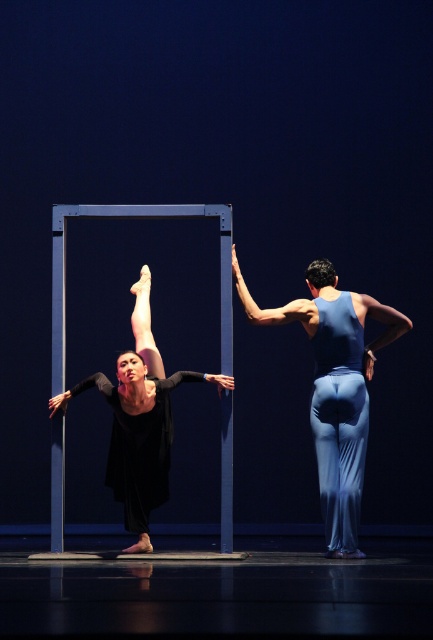
Question: Is blue fabric pants at center bigger than black matte dress at center?

Choices:
 (A) no
 (B) yes

Answer: (A)

Question: Where is blue fabric pants at center located in relation to black matte dress at center in the image?

Choices:
 (A) above
 (B) below

Answer: (A)

Question: Among these points, which one is farthest from the camera?

Choices:
 (A) (148, 321)
 (B) (345, 419)

Answer: (A)

Question: Does blue fabric pants at center appear over black matte dress at center?

Choices:
 (A) yes
 (B) no

Answer: (A)

Question: Which object appears farthest from the camera in this image?

Choices:
 (A) black matte dress at center
 (B) blue fabric pants at center

Answer: (B)